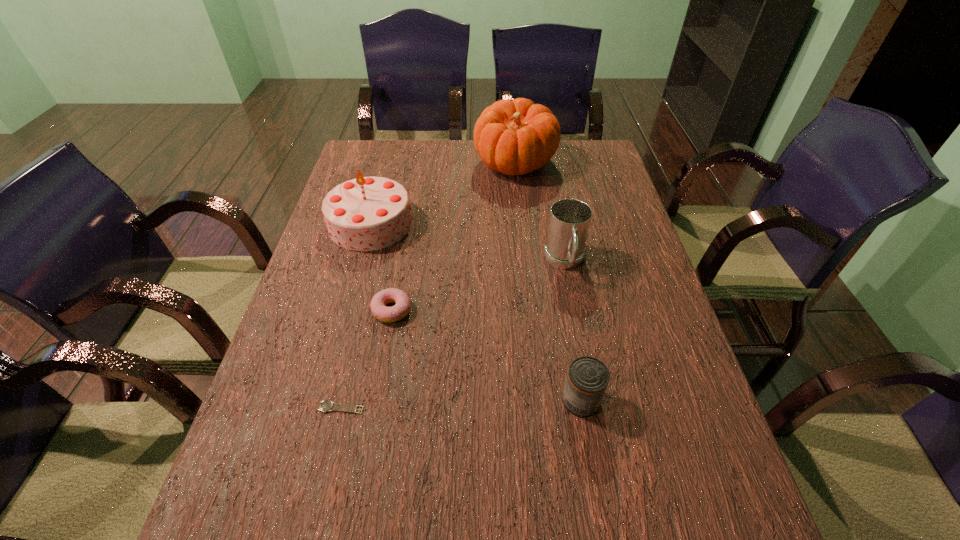
Locate an element on the screen. vacant space located on the left of the fourth tallest object is located at coordinates (533, 400).

What are the coordinates of `free space located on the front of the doughnut` in the screenshot? It's located at (360, 485).

Image resolution: width=960 pixels, height=540 pixels. Find the location of `free space located 0.130m on the left of the watch`. free space located 0.130m on the left of the watch is located at coordinates (254, 408).

Identify the location of object that is at the far edge. This screenshot has height=540, width=960. (517, 137).

I want to click on birthday cake that is at the left edge, so click(x=367, y=213).

You are a GUI agent. You are given a task and a screenshot of the screen. Output one action in this format:
    pyautogui.click(x=<x>, y=<y>)
    Task: Click on the watch situated at the left edge
    The width and height of the screenshot is (960, 540).
    Given the screenshot: What is the action you would take?
    pyautogui.click(x=325, y=406)

Locate an element on the screen. vacant region at the left edge of the desktop is located at coordinates (316, 467).

The image size is (960, 540). In the image, there is a desktop. What are the coordinates of `vacant space at the right edge` in the screenshot? It's located at (697, 483).

Image resolution: width=960 pixels, height=540 pixels. I want to click on vacant space at the far left corner of the desktop, so point(389,172).

You are a GUI agent. You are given a task and a screenshot of the screen. Output one action in this format:
    pyautogui.click(x=<x>, y=<y>)
    Task: Click on the free spot between the birthday cake and the fourth farthest object
    Image resolution: width=960 pixels, height=540 pixels.
    Given the screenshot: What is the action you would take?
    pyautogui.click(x=381, y=267)